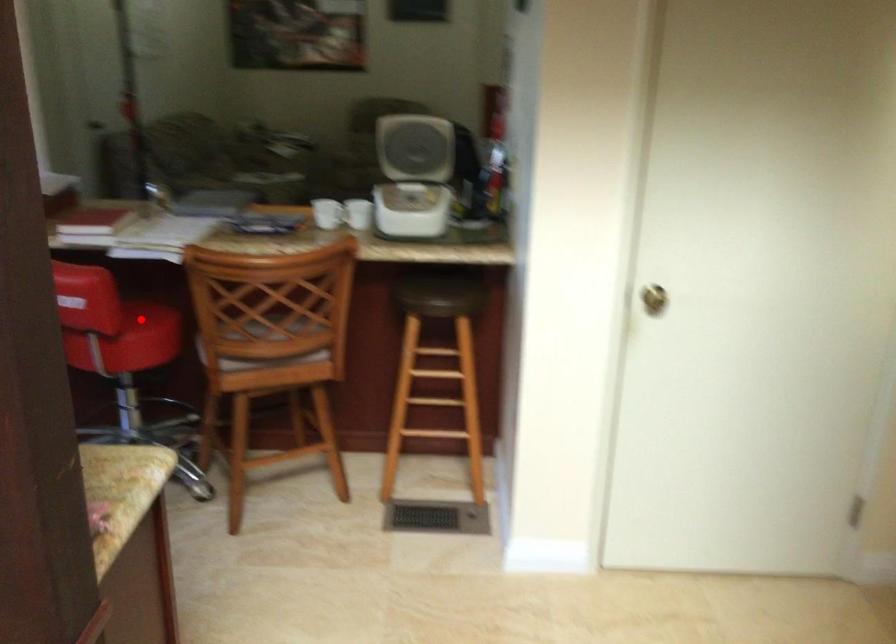
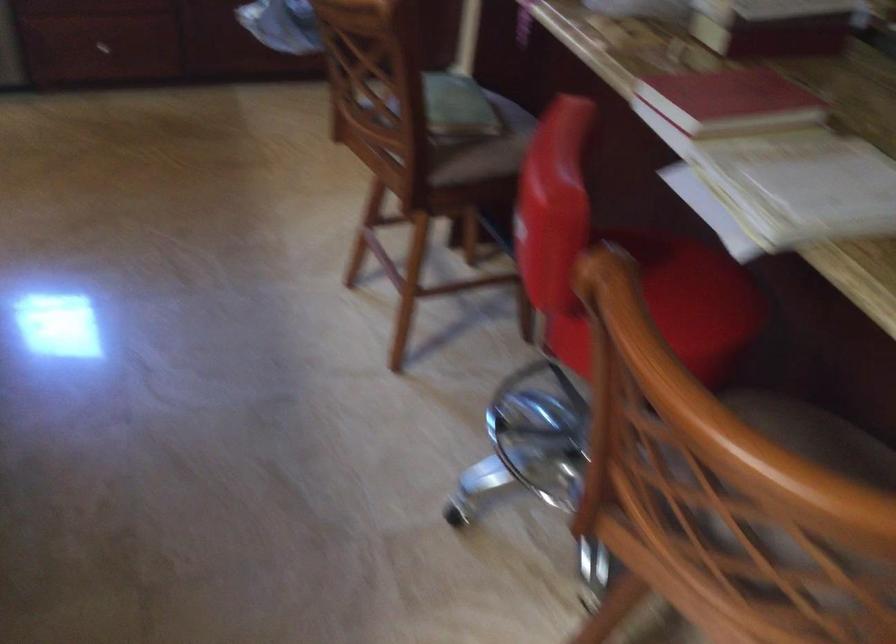
Question: I am providing you with two images of the same scene from different viewpoints. A red point is marked on the first image. Can you still see the location of the red point in image 2?

Choices:
 (A) Yes
 (B) No

Answer: (B)